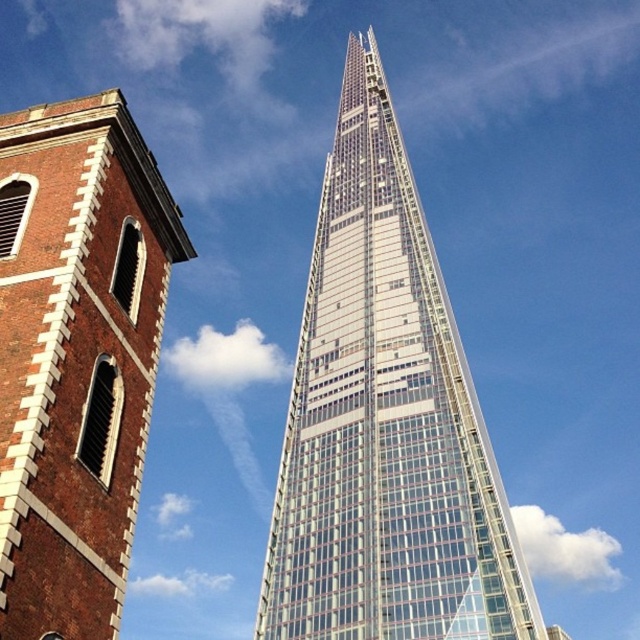
Can you confirm if transparent glass tower at center is positioned to the right of brick tower at left?

Yes, transparent glass tower at center is to the right of brick tower at left.

Who is positioned more to the right, transparent glass tower at center or brick tower at left?

Positioned to the right is transparent glass tower at center.

Does point (369, 376) come in front of point (8, 236)?

No, it is not.

Find the location of a particular element. The height and width of the screenshot is (640, 640). transparent glass tower at center is located at coordinates (385, 422).